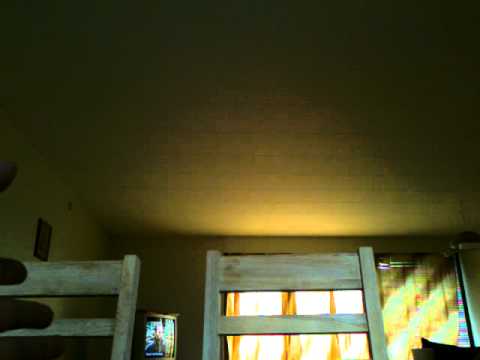
Locate an element on the screen. light on ceiling is located at coordinates (254, 201).